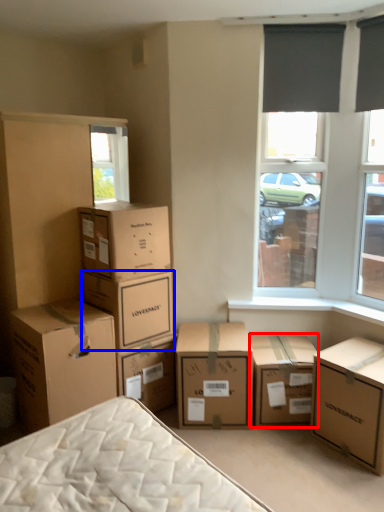
Question: Which point is further to the camera, box (highlighted by a red box) or box (highlighted by a blue box)?

Choices:
 (A) box
 (B) box

Answer: (A)